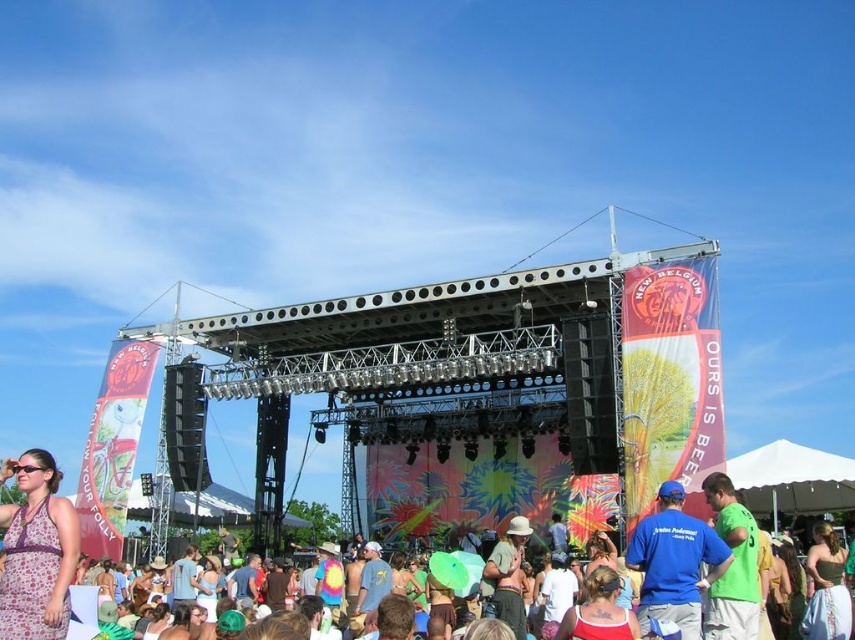
You are a photographer at the festival and want to capture both the floral dress at lower left and the green fabric shirt at center in a single shot. Which object is closer to your camera?

The floral dress at lower left is closer to the camera since it is further to the viewer than the green fabric shirt at center.

You are a photographer standing at the edge of the concert area. You want to take a photo of the blue cotton shirt at center and the stage backdrop. How far apart are these two objects from each other?

The blue cotton shirt at center and the stage backdrop are 65.27 meters apart.

You are standing at the point closest to the stage in the image. There are two points marked in the scene. One is at coordinate point (62, 570) and the other is at coordinate point (628, 554). Which point is farther away from you?

Point (62, 570) is behind point (628, 554), so the point farther away from you is point (62, 570).